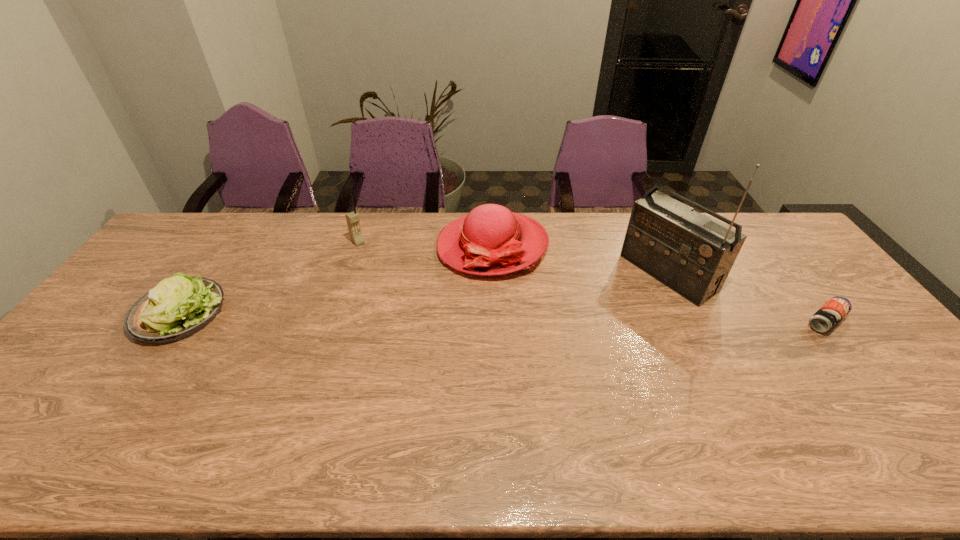
This screenshot has width=960, height=540. Identify the location of free space located 0.060m on the left of the leftmost object. (115, 313).

The image size is (960, 540). Identify the location of vacant area situated on the left of the shortest object. (753, 321).

This screenshot has height=540, width=960. Identify the location of vacant space situated on the front panel of the tallest object. (632, 299).

Find the location of a particular element. The image size is (960, 540). free region located on the front panel of the tallest object is located at coordinates (558, 346).

You are a GUI agent. You are given a task and a screenshot of the screen. Output one action in this format:
    pyautogui.click(x=<x>, y=<y>)
    Task: Click on the vacant space located 0.280m on the front panel of the tallest object
    This screenshot has height=540, width=960.
    Given the screenshot: What is the action you would take?
    pyautogui.click(x=577, y=334)

The width and height of the screenshot is (960, 540). Find the location of `vacant space situated 0.120m at the front of the third object from right to left with a bow`. vacant space situated 0.120m at the front of the third object from right to left with a bow is located at coordinates (432, 296).

Find the location of a particular element. The width and height of the screenshot is (960, 540). blank space located at the front of the third object from right to left with a bow is located at coordinates 403,319.

This screenshot has height=540, width=960. What are the coordinates of `free space located at the front of the third object from right to left with a bow` in the screenshot? It's located at (382, 336).

In order to click on vacant space located 0.330m on the front of the cellular telephone, where the keypad is located in this screenshot , I will do `click(417, 298)`.

At what (x,y) coordinates should I click in order to perform the action: click on vacant space positioned on the front of the cellular telephone, where the keypad is located. Please return your answer as a coordinate pair (x, y). The width and height of the screenshot is (960, 540). Looking at the image, I should click on (398, 280).